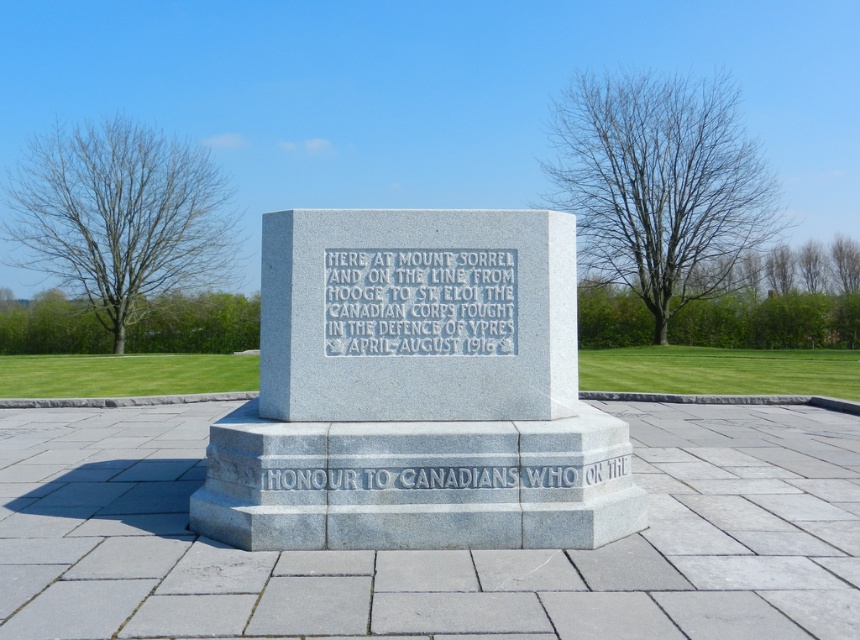
What is the relationship between the width of the gray stone monument at center and the gray stone plaque at center?

The gray stone monument at center is wider than the gray stone plaque at center.

You are standing at the monument and notice two points marked on the ground. The first point is at coordinate point(258, 541) and the second is at point(456, 272). If you are facing the monument, which point is closer to you?

Point(258, 541) is in front of point(456, 272), so if you are facing the monument, point(258, 541) is closer to you.

What is the spatial relationship between the gray stone monument at center and the gray stone plaque at center based on their positions in the image?

The gray stone monument at center is in front of the gray stone plaque at center, meaning the monument blocks part of the plaque from view.